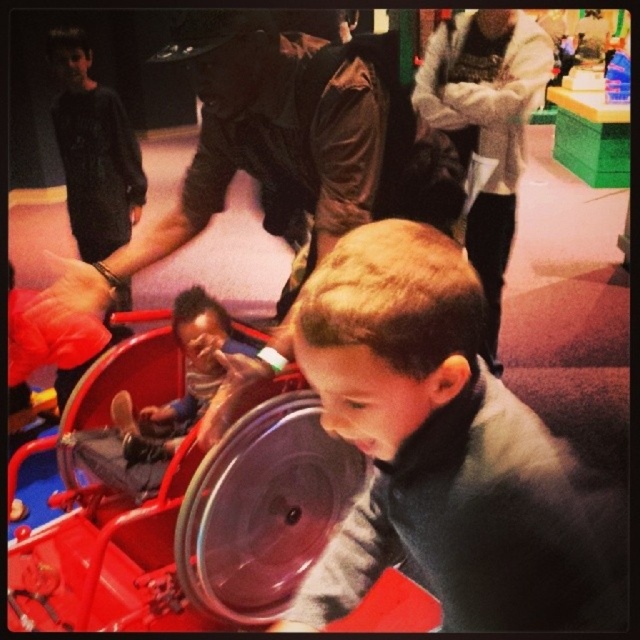
Question: Considering the relative positions of brown leather jacket at upper center and smooth plastic toy at center in the image provided, where is brown leather jacket at upper center located with respect to smooth plastic toy at center?

Choices:
 (A) right
 (B) left

Answer: (A)

Question: Does white fleece jacket at upper center appear on the left side of smooth plastic toy at center?

Choices:
 (A) yes
 (B) no

Answer: (B)

Question: Is white fleece jacket at upper center wider than smooth plastic toy at center?

Choices:
 (A) yes
 (B) no

Answer: (A)

Question: Based on their relative distances, which object is nearer to the brown leather jacket at upper center?

Choices:
 (A) smooth plastic toy at center
 (B) white fleece jacket at upper center

Answer: (A)

Question: Which of the following is the farthest from the observer?

Choices:
 (A) (392, 179)
 (B) (172, 454)

Answer: (B)

Question: Which point appears farthest from the camera in this image?

Choices:
 (A) (490, 349)
 (B) (592, 582)
 (C) (388, 154)
 (D) (176, 403)

Answer: (A)